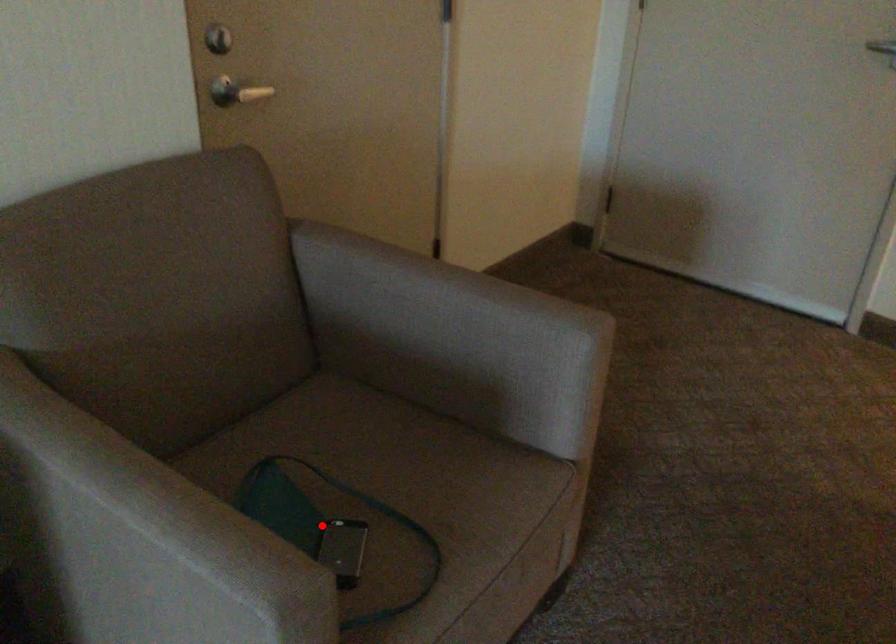
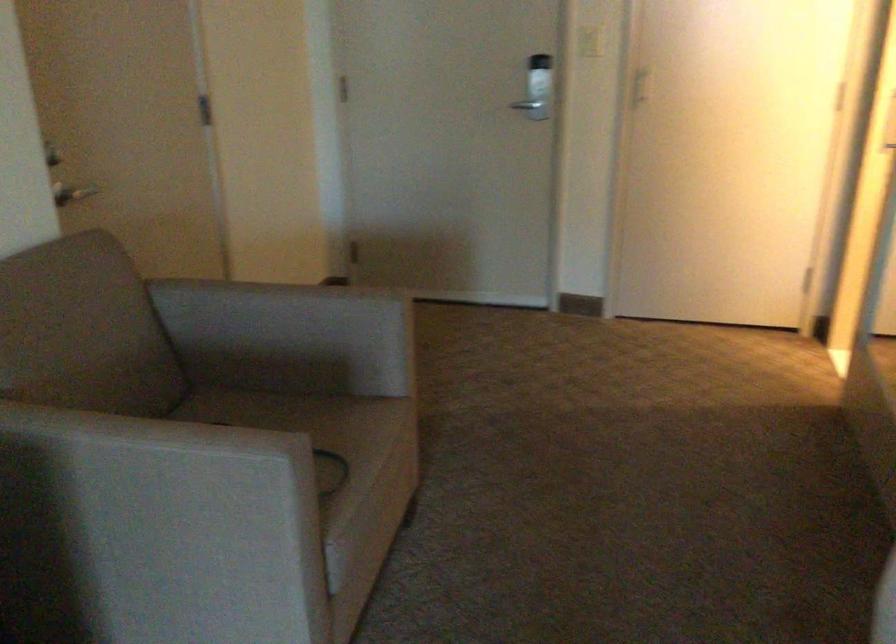
Question: I am providing you with two images of the same scene from different viewpoints. A red point is marked on the first image. Is the red point's position out of view in image 2?

Choices:
 (A) Yes
 (B) No

Answer: (A)